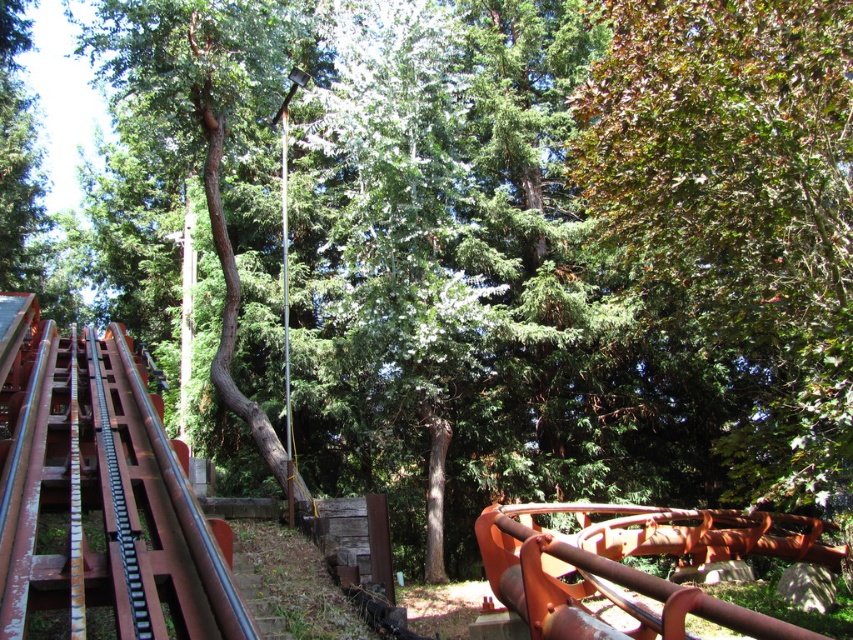
Consider the image. You are a maintenance worker needing to inspect both the green leafy tree at upper right and the rusty metal train track at left. You have a ladder that is 8 meters long. Can you use this ladder to reach both objects without moving it?

The distance between the green leafy tree at upper right and the rusty metal train track at left is 8.29 meters. Since the ladder is only 8 meters long, it is too short to span the gap between them. Therefore, you would need to move the ladder to reach both objects.

You are a park maintenance worker assessing the roller coaster area. You notice the green leafy tree at upper right and the rusty metal train track at left. Which object is bigger in size?

The green leafy tree at upper right is larger in size than the rusty metal train track at left.

Consider the image. You are a park visitor trying to take a photo of the green leafy tree at upper right and the rusty metal roller coaster rail at lower right. Which object appears narrower in the photo?

The green leafy tree at upper right appears narrower in the photo because it has a lesser width compared to the rusty metal roller coaster rail at lower right.